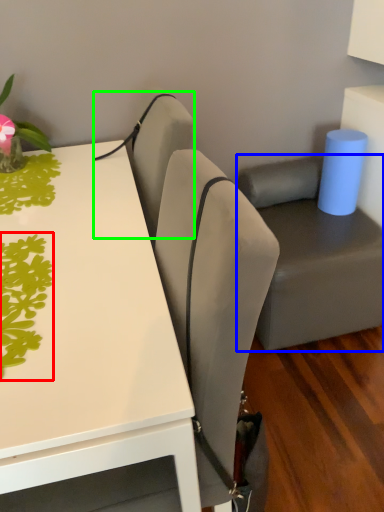
Question: Which object is positioned closest to plant (highlighted by a red box)? Select from swivel chair (highlighted by a blue box) and armchair (highlighted by a green box).

Choices:
 (A) swivel chair
 (B) armchair

Answer: (B)